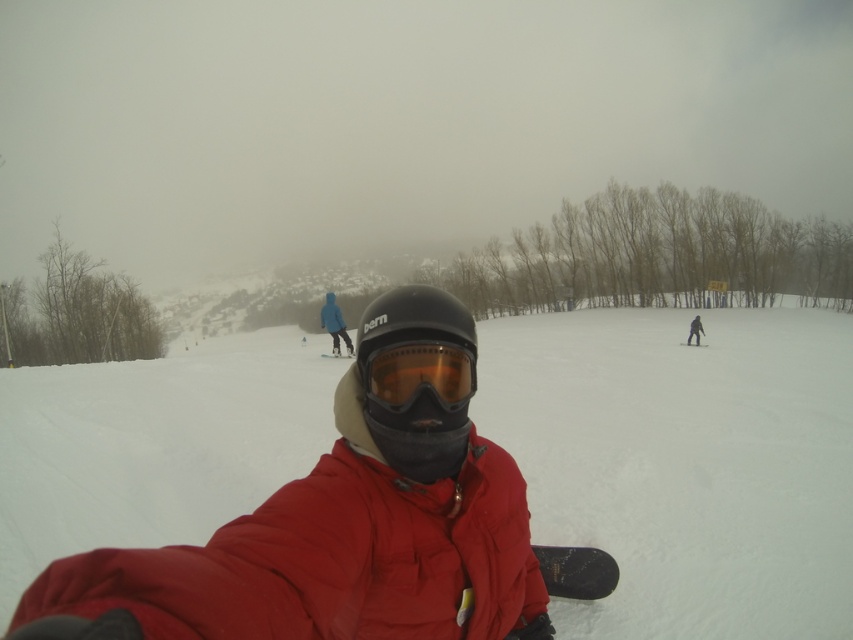
Does blue fabric snowsuit at center appear on the right side of blue glossy snowboard at center?

Indeed, blue fabric snowsuit at center is positioned on the right side of blue glossy snowboard at center.

Who is taller, blue fabric snowsuit at center or blue glossy snowboard at center?

Standing taller between the two is blue fabric snowsuit at center.

Which is behind, point (323, 305) or point (328, 353)?

Point (328, 353)

Identify the location of blue fabric snowsuit at center. This screenshot has width=853, height=640. (334, 323).

Who is shorter, orange tinted plastic goggles at center or blue fabric snowsuit at center?

Standing shorter between the two is orange tinted plastic goggles at center.

Is orange tinted plastic goggles at center smaller than blue fabric snowsuit at center?

Yes, orange tinted plastic goggles at center is smaller than blue fabric snowsuit at center.

You are a GUI agent. You are given a task and a screenshot of the screen. Output one action in this format:
    pyautogui.click(x=<x>, y=<y>)
    Task: Click on the orange tinted plastic goggles at center
    
    Given the screenshot: What is the action you would take?
    pyautogui.click(x=419, y=374)

Does orange tinted plastic goggles at center have a smaller size compared to black matte snowboard at lower center?

Yes.

Between orange tinted plastic goggles at center and black matte snowboard at lower center, which one is positioned lower?

black matte snowboard at lower center is lower down.

Locate an element on the screen. orange tinted plastic goggles at center is located at coordinates (419, 374).